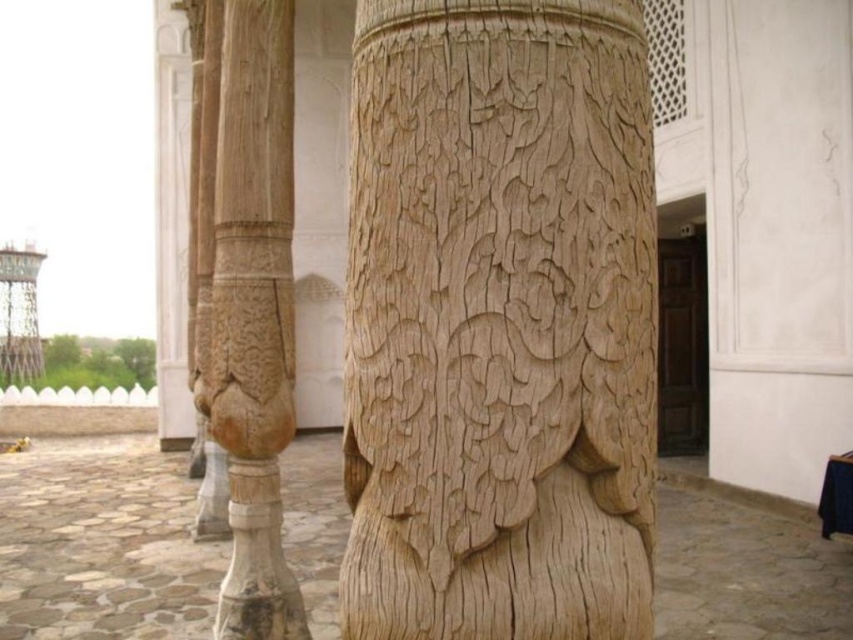
You are an architect examining the columns in the image. You notice two columns at the center, one labeled as natural wood column at center and the other as wooden carved column at center. Which of these two columns is shorter?

The natural wood column at center is shorter compared to the wooden carved column at center.

You are standing in front of a historical building and want to take a photo of the natural wood column at center. If your camera is 4.40 feet away from the column, will you be able to capture the entire column in the frame?

The natural wood column at center and camera are 4.40 feet apart from each other. To determine if the entire column can be captured, consider the camera lens angle and sensor size. However, based on the given distance alone, it is possible if the camera settings allow framing at that distance.

You are an architect inspecting two columns in a historical building. You see the natural wood column at center and the wooden carved column at center. Which column is located to the right of the other?

The natural wood column at center is positioned on the right side of wooden carved column at center.